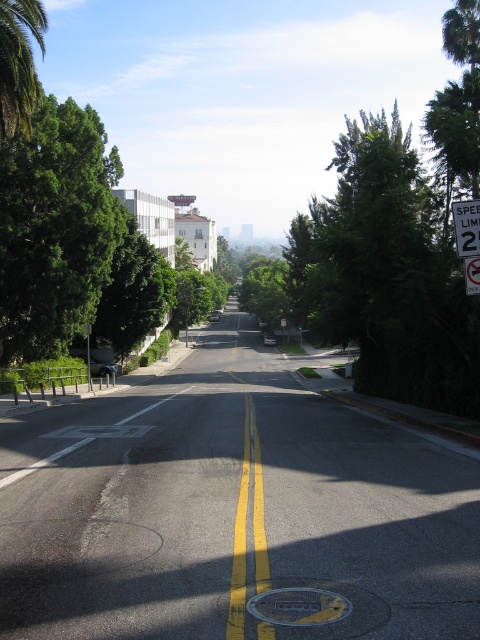
Does green leafy palm tree at upper left appear under metal speed limit sign at right?

No.

Find the location of a particular element. The height and width of the screenshot is (640, 480). green leafy palm tree at upper left is located at coordinates (19, 61).

What are the coordinates of `green leafy palm tree at upper left` in the screenshot? It's located at (19, 61).

Between green leafy palm tree at upper left and white plastic speed limit sign at upper right, which one appears on the left side from the viewer's perspective?

green leafy palm tree at upper left

Can you confirm if green leafy palm tree at upper left is thinner than white plastic speed limit sign at upper right?

In fact, green leafy palm tree at upper left might be wider than white plastic speed limit sign at upper right.

What do you see at coordinates (19, 61) in the screenshot? This screenshot has width=480, height=640. I see `green leafy palm tree at upper left` at bounding box center [19, 61].

You are a GUI agent. You are given a task and a screenshot of the screen. Output one action in this format:
    pyautogui.click(x=<x>, y=<y>)
    Task: Click on the green leafy palm tree at upper left
    
    Given the screenshot: What is the action you would take?
    pyautogui.click(x=19, y=61)

Is metal speed limit sign at right to the left of white plastic speed limit sign at upper right from the viewer's perspective?

Yes, metal speed limit sign at right is to the left of white plastic speed limit sign at upper right.

Who is higher up, metal speed limit sign at right or white plastic speed limit sign at upper right?

metal speed limit sign at right is above.

Is point (468, 212) in front of point (478, 288)?

That is False.

What are the coordinates of `metal speed limit sign at right` in the screenshot? It's located at (467, 227).